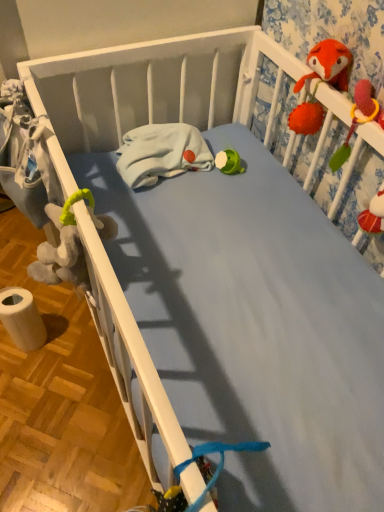
Question: Can you see soft plush toy at upper right touching white fleece blanket at center?

Choices:
 (A) yes
 (B) no

Answer: (B)

Question: Are soft plush toy at upper right and white fleece blanket at center located far from each other?

Choices:
 (A) no
 (B) yes

Answer: (A)

Question: Does soft plush toy at upper right have a lesser width compared to white fleece blanket at center?

Choices:
 (A) yes
 (B) no

Answer: (A)

Question: From the image's perspective, is soft plush toy at upper right under white fleece blanket at center?

Choices:
 (A) yes
 (B) no

Answer: (A)

Question: Can you confirm if soft plush toy at upper right is shorter than white fleece blanket at center?

Choices:
 (A) no
 (B) yes

Answer: (A)

Question: Is soft plush toy at upper right further to camera compared to white fleece blanket at center?

Choices:
 (A) no
 (B) yes

Answer: (A)

Question: Is white paper towel at lower left taller than soft plush toy at upper right?

Choices:
 (A) yes
 (B) no

Answer: (A)

Question: From a real-world perspective, is white paper towel at lower left below soft plush toy at upper right?

Choices:
 (A) yes
 (B) no

Answer: (A)

Question: Can you confirm if white paper towel at lower left is positioned to the right of soft plush toy at upper right?

Choices:
 (A) no
 (B) yes

Answer: (A)

Question: From the image's perspective, is white paper towel at lower left under soft plush toy at upper right?

Choices:
 (A) yes
 (B) no

Answer: (A)

Question: Is white paper towel at lower left not within soft plush toy at upper right?

Choices:
 (A) yes
 (B) no

Answer: (A)

Question: Is white paper towel at lower left in contact with soft plush toy at upper right?

Choices:
 (A) no
 (B) yes

Answer: (A)

Question: Can you confirm if white fleece blanket at center is taller than white paper towel at lower left?

Choices:
 (A) no
 (B) yes

Answer: (A)